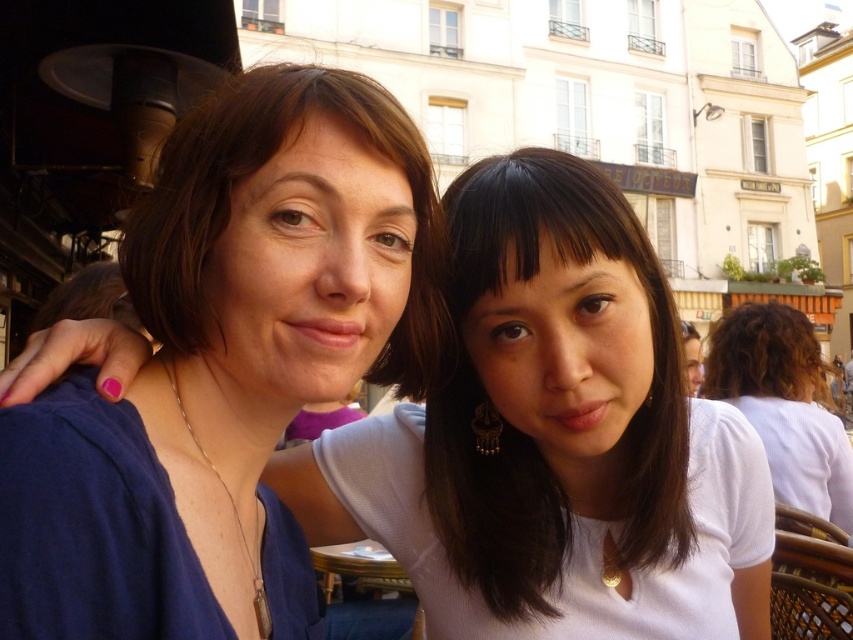
Is white matte shirt at center positioned behind smooth white blouse at center?

No, it is not.

Based on the photo, who is more distant from viewer, [763,556] or [537,579]?

The point [763,556] is behind.

I want to click on white matte shirt at center, so click(x=553, y=438).